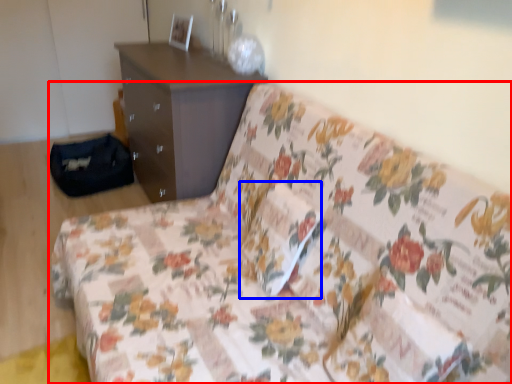
Question: Which object is closer to the camera taking this photo, studio couch (highlighted by a red box) or pillow (highlighted by a blue box)?

Choices:
 (A) studio couch
 (B) pillow

Answer: (A)